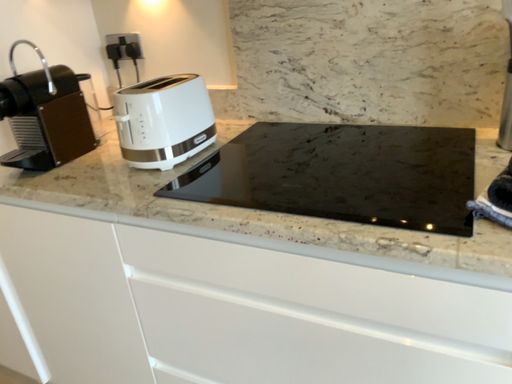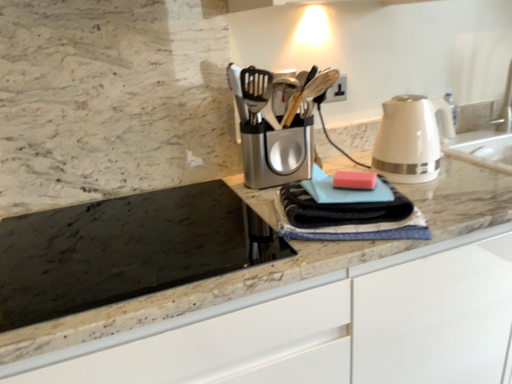
Question: How did the camera likely rotate when shooting the video?

Choices:
 (A) rotated upward
 (B) rotated downward

Answer: (A)